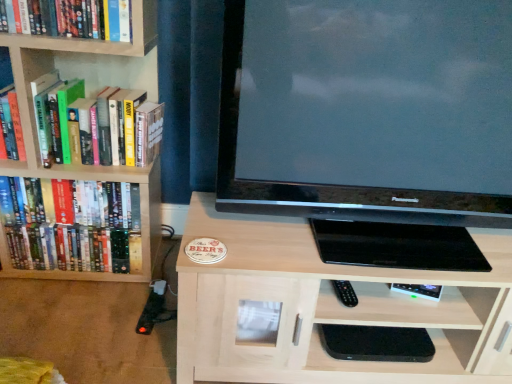
In order to face light wood cabinet at center, should I rotate leftwards or rightwards?

Turn right by 15.951 degrees to look at light wood cabinet at center.

At what (x,y) coordinates should I click in order to perform the action: click on hardcover books at left, which is counted as the second book, starting from the bottom. Please return your answer as a coordinate pair (x, y). This screenshot has height=384, width=512. Looking at the image, I should click on (98, 124).

What do you see at coordinates (82, 165) in the screenshot?
I see `wooden bookshelf at left` at bounding box center [82, 165].

Identify the location of wooden bookshelf at left. Image resolution: width=512 pixels, height=384 pixels. (82, 165).

Where is `hardcover book at upper left, placed as the 3th book when sorted from bottom to top`? hardcover book at upper left, placed as the 3th book when sorted from bottom to top is located at coordinates (67, 18).

Where is `light wood cabinet at center`? This screenshot has width=512, height=384. light wood cabinet at center is located at coordinates (328, 307).

Locate an element on the screen. Image resolution: width=512 pixels, height=384 pixels. bookcase on the left of the hardcover books at left, the 3th book when ordered from top to bottom is located at coordinates (82, 165).

Does hardcover books at left, the 3th book when ordered from top to bottom, appear on the right side of wooden bookshelf at left?

Yes, hardcover books at left, the 3th book when ordered from top to bottom, is to the right of wooden bookshelf at left.

Is hardcover books at left, positioned as the first book in bottom-to-top order, facing towards wooden bookshelf at left?

Yes, hardcover books at left, positioned as the first book in bottom-to-top order, faces towards wooden bookshelf at left.

Considering the sizes of objects hardcover books at left, the 3th book when ordered from top to bottom, and wooden bookshelf at left in the image provided, who is shorter, hardcover books at left, the 3th book when ordered from top to bottom, or wooden bookshelf at left?

hardcover books at left, the 3th book when ordered from top to bottom.

Looking at this image, can we say hardcover books at left, the 3th book when ordered from top to bottom, lies outside hardcover book at upper left, positioned as the first book in top-to-bottom order?

Yes, hardcover books at left, the 3th book when ordered from top to bottom, is not within hardcover book at upper left, positioned as the first book in top-to-bottom order.

How different are the orientations of hardcover books at left, positioned as the first book in bottom-to-top order, and hardcover book at upper left, positioned as the first book in top-to-bottom order, in degrees?

hardcover books at left, positioned as the first book in bottom-to-top order, and hardcover book at upper left, positioned as the first book in top-to-bottom order, are facing 0.198 degrees away from each other.

Is point (12, 246) more distant than point (91, 26)?

Yes, it is.

Considering the sizes of objects matte black television at center and wooden bookshelf at left in the image provided, who is bigger, matte black television at center or wooden bookshelf at left?

With larger size is wooden bookshelf at left.

Is matte black television at center not inside wooden bookshelf at left?

That's correct, matte black television at center is outside of wooden bookshelf at left.

Based on the photo, from a real-world perspective, who is located lower, matte black television at center or wooden bookshelf at left?

From a 3D spatial view, wooden bookshelf at left is below.

Does point (80, 119) come behind point (180, 355)?

Yes.

Is the surface of hardcover books at left, which ranks as the 2th book in top-to-bottom order, in direct contact with light wood cabinet at center?

They are not placed beside each other.

Is hardcover books at left, which is counted as the second book, starting from the bottom, taller or shorter than light wood cabinet at center?

Considering their sizes, hardcover books at left, which is counted as the second book, starting from the bottom, has less height than light wood cabinet at center.

How many degrees apart are the facing directions of hardcover books at left, which is counted as the second book, starting from the bottom, and light wood cabinet at center?

The angular difference between hardcover books at left, which is counted as the second book, starting from the bottom, and light wood cabinet at center is 0.443 degrees.

From the image's perspective, which object appears higher, wooden bookshelf at left or hardcover books at left, which ranks as the 2th book in top-to-bottom order?

hardcover books at left, which ranks as the 2th book in top-to-bottom order.

Is wooden bookshelf at left not within hardcover books at left, which ranks as the 2th book in top-to-bottom order?

Indeed, wooden bookshelf at left is completely outside hardcover books at left, which ranks as the 2th book in top-to-bottom order.

Which is more distant, (149, 51) or (142, 166)?

The point (142, 166) is farther.

Does wooden bookshelf at left appear on the right side of hardcover books at left, which ranks as the 2th book in top-to-bottom order?

In fact, wooden bookshelf at left is to the left of hardcover books at left, which ranks as the 2th book in top-to-bottom order.

Is light wood cabinet at center not within wooden bookshelf at left?

Yes, light wood cabinet at center is outside of wooden bookshelf at left.

What's the angular difference between light wood cabinet at center and wooden bookshelf at left's facing directions?

The facing directions of light wood cabinet at center and wooden bookshelf at left are 0.443 degrees apart.

In the image, there is a light wood cabinet at center. Identify the location of bookcase above it (from the image's perspective). The height and width of the screenshot is (384, 512). (82, 165).

Based on their sizes in the image, would you say light wood cabinet at center is bigger or smaller than wooden bookshelf at left?

light wood cabinet at center is bigger than wooden bookshelf at left.

The width and height of the screenshot is (512, 384). Identify the location of the 1st book behind when counting from the hardcover book at upper left, placed as the 3th book when sorted from bottom to top. (98, 124).

Would you consider hardcover book at upper left, positioned as the first book in top-to-bottom order, to be distant from hardcover books at left, which ranks as the 2th book in top-to-bottom order?

Actually, hardcover book at upper left, positioned as the first book in top-to-bottom order, and hardcover books at left, which ranks as the 2th book in top-to-bottom order, are a little close together.

Which is nearer, (50, 21) or (68, 141)?

The point (50, 21) is in front.

How different are the orientations of hardcover book at upper left, placed as the 3th book when sorted from bottom to top, and hardcover books at left, which ranks as the 2th book in top-to-bottom order, in degrees?

The angular difference between hardcover book at upper left, placed as the 3th book when sorted from bottom to top, and hardcover books at left, which ranks as the 2th book in top-to-bottom order, is 0.682 degrees.

Locate an element on the screen. Image resolution: width=512 pixels, height=384 pixels. bookcase lying on the left of hardcover books at left, the 3th book when ordered from top to bottom is located at coordinates (82, 165).

This screenshot has width=512, height=384. There is a hardcover book at upper left, positioned as the first book in top-to-bottom order. In order to click on the 2nd book below it (from a real-world perspective) in this screenshot , I will do (x=73, y=227).

Based on their spatial positions, is wooden bookshelf at left or hardcover book at upper left, positioned as the first book in top-to-bottom order, closer to hardcover books at left, the 3th book when ordered from top to bottom?

Based on the image, wooden bookshelf at left appears to be nearer to hardcover books at left, the 3th book when ordered from top to bottom.

Estimate the real-world distances between objects in this image. Which object is closer to hardcover book at upper left, positioned as the first book in top-to-bottom order, light wood cabinet at center or wooden bookshelf at left?

Based on the image, wooden bookshelf at left appears to be nearer to hardcover book at upper left, positioned as the first book in top-to-bottom order.

Based on their spatial positions, is wooden bookshelf at left or hardcover book at upper left, placed as the 3th book when sorted from bottom to top, closer to matte black television at center?

Among the two, wooden bookshelf at left is located nearer to matte black television at center.

Based on their spatial positions, is light wood cabinet at center or hardcover books at left, the 3th book when ordered from top to bottom, closer to wooden bookshelf at left?

hardcover books at left, the 3th book when ordered from top to bottom, is closer to wooden bookshelf at left.

In the scene shown: Estimate the real-world distances between objects in this image. Which object is further from hardcover books at left, which ranks as the 2th book in top-to-bottom order, matte black television at center or hardcover book at upper left, positioned as the first book in top-to-bottom order?

matte black television at center lies further to hardcover books at left, which ranks as the 2th book in top-to-bottom order, than the other object.

Considering their positions, is wooden bookshelf at left positioned closer to matte black television at center than light wood cabinet at center?

light wood cabinet at center.

When comparing their distances from wooden bookshelf at left, does light wood cabinet at center or matte black television at center seem further?

The object further to wooden bookshelf at left is light wood cabinet at center.

Considering their positions, is matte black television at center positioned further to wooden bookshelf at left than light wood cabinet at center?

light wood cabinet at center is positioned further to the anchor wooden bookshelf at left.

Image resolution: width=512 pixels, height=384 pixels. In order to click on television located between hardcover books at left, the 3th book when ordered from top to bottom, and light wood cabinet at center in the left-right direction in this screenshot , I will do `click(368, 110)`.

This screenshot has height=384, width=512. I want to click on book that lies between hardcover book at upper left, positioned as the first book in top-to-bottom order, and wooden bookshelf at left from top to bottom, so click(x=98, y=124).

The image size is (512, 384). I want to click on television between hardcover book at upper left, positioned as the first book in top-to-bottom order, and light wood cabinet at center, so click(x=368, y=110).

Find the location of a particular element. The width and height of the screenshot is (512, 384). television situated between hardcover books at left, which is counted as the second book, starting from the bottom, and light wood cabinet at center from left to right is located at coordinates (368, 110).